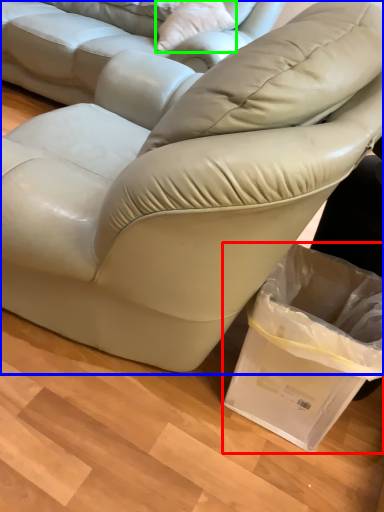
Question: Considering the real-world distances, which object is closest to shopping bag (highlighted by a red box)? studio couch (highlighted by a blue box) or throw pillow (highlighted by a green box).

Choices:
 (A) studio couch
 (B) throw pillow

Answer: (A)